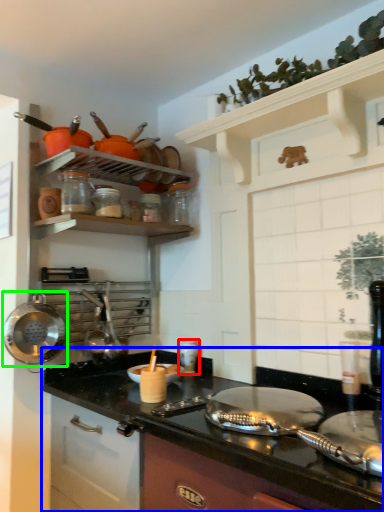
Question: Considering the real-world distances, which object is farthest from appliance (highlighted by a red box)? countertop (highlighted by a blue box) or wok (highlighted by a green box)?

Choices:
 (A) countertop
 (B) wok

Answer: (B)